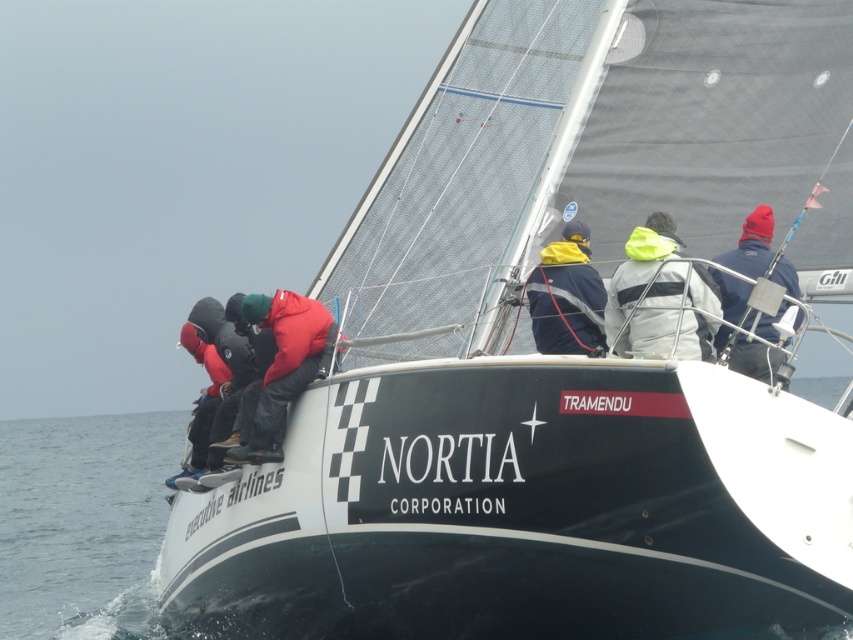
Who is taller, dark blue and yellow jacket at center or blue fabric jacket at upper right?

Standing taller between the two is dark blue and yellow jacket at center.

Can you confirm if dark blue and yellow jacket at center is bigger than blue fabric jacket at upper right?

No, dark blue and yellow jacket at center is not bigger than blue fabric jacket at upper right.

Locate an element on the screen. dark blue and yellow jacket at center is located at coordinates (567, 296).

This screenshot has height=640, width=853. In order to click on dark blue and yellow jacket at center in this screenshot , I will do `click(567, 296)`.

In the scene shown: Is transparent water at lower left above blue fabric jacket at upper right?

Incorrect, transparent water at lower left is not positioned above blue fabric jacket at upper right.

Which is in front, point (833, 627) or point (741, 288)?

Point (833, 627)

Does point (70, 454) come farther from viewer compared to point (728, 305)?

Yes, point (70, 454) is farther from viewer.

This screenshot has width=853, height=640. What are the coordinates of `transparent water at lower left` in the screenshot? It's located at (109, 538).

Is point (97, 600) more distant than point (286, 321)?

That is True.

Is transparent water at lower left wider than red matte jacket at center?

Yes.

Who is more forward, (x=88, y=589) or (x=288, y=384)?

Positioned in front is point (x=288, y=384).

The width and height of the screenshot is (853, 640). What are the coordinates of `transparent water at lower left` in the screenshot? It's located at (109, 538).